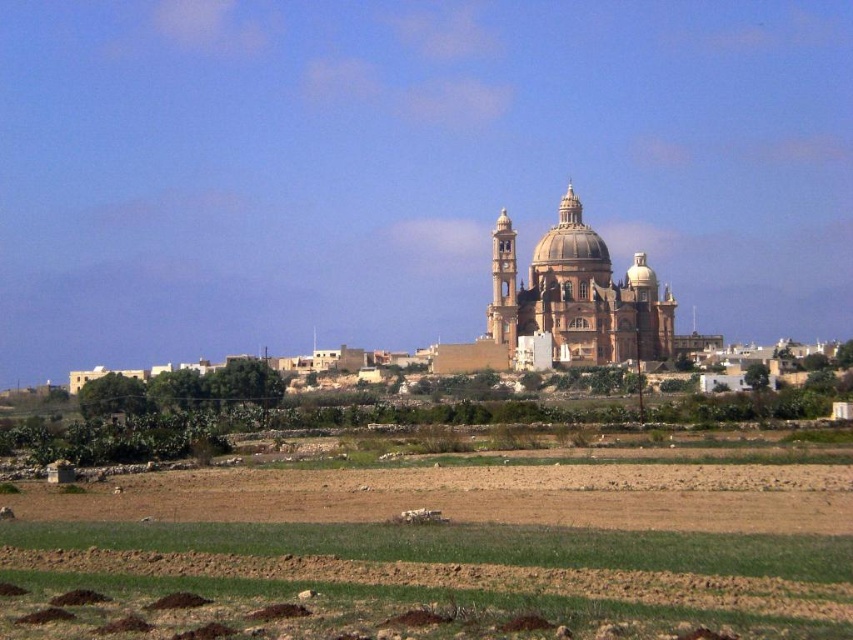
Does brown soil field at lower center come in front of brown stone church at center?

Yes, it is.

Find the location of a particular element. brown soil field at lower center is located at coordinates (442, 552).